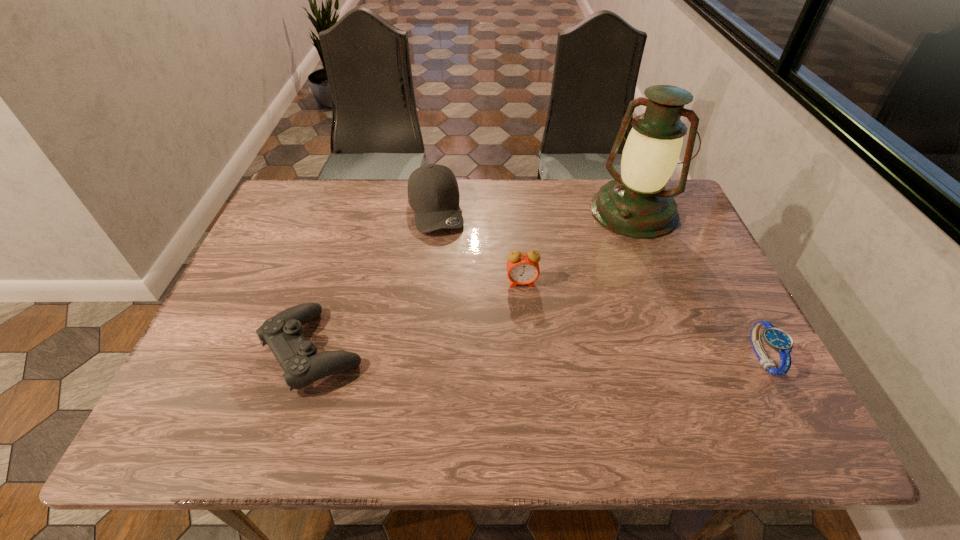
The width and height of the screenshot is (960, 540). I want to click on vacant space on the desktop that is between the leftmost object and the watch and is positioned on the front brim of the fourth object from right to left, so click(x=479, y=353).

Locate an element on the screen. free spot on the desktop that is between the leftmost object and the watch and is positioned on the face of the alarm clock is located at coordinates (529, 354).

In order to click on free spot on the desktop that is between the control and the watch and is positioned with the light compartment facing forward on the lantern in this screenshot , I will do `click(526, 354)`.